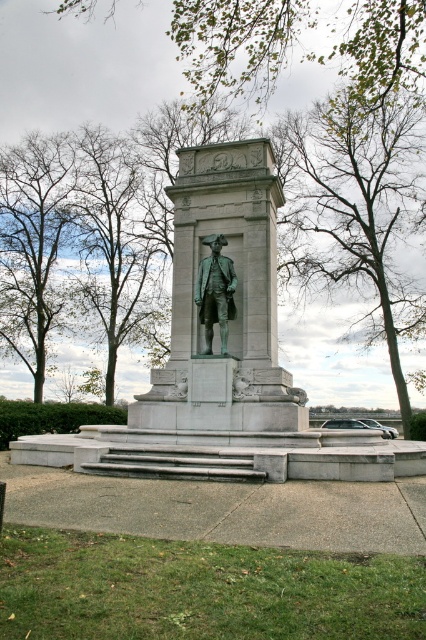
You are a photographer standing in front of the monument. You want to take a photo of the green polished stone statue at center without the brown leafy tree at left appearing in the background. Is this possible based on their positions?

The green polished stone statue at center is in front of the brown leafy tree at left, so yes, you can take a photo of the green polished stone statue at center without the brown leafy tree at left in the background by positioning yourself so the statue blocks the view of the tree.

You are standing in front of the monument and notice a point marked at coordinates (239,42). What object does this point correspond to?

The point at coordinates (239,42) corresponds to the green leafy branches at upper center.

You are a photographer standing at the base of the monument. You want to take a photo that includes both the green leafy branches at upper center and the bronze statue at center. Which object should you focus on to ensure both are in the frame without zooming in or out?

You should focus on the bronze statue at center because the green leafy branches at upper center is larger in size than bronze statue at center, so adjusting focus on the smaller object allows both to fit within the frame.